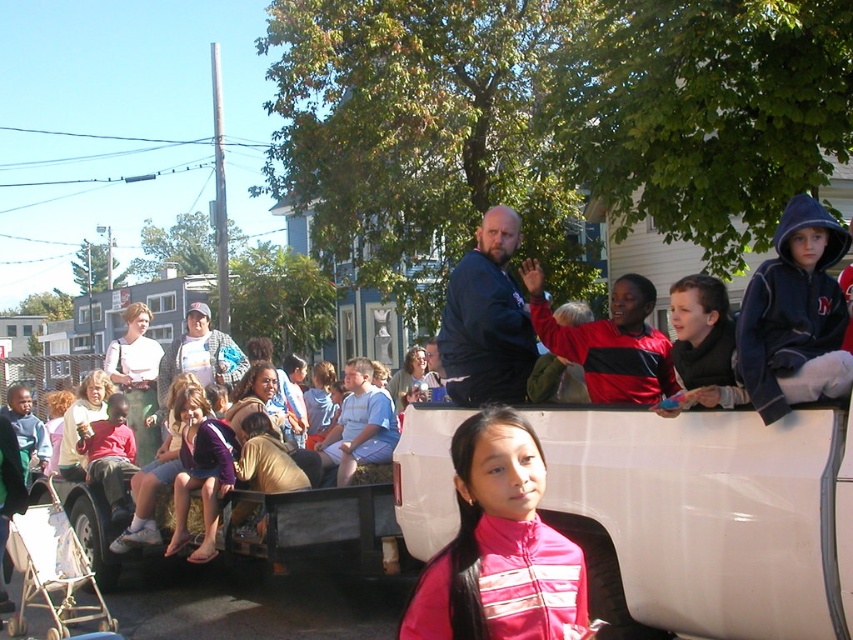
You are a photographer trying to capture the best shot of the dark blue hoodie at right and the red and black jacket at upper right. Which one can you focus on more clearly if you adjust your camera to focus on the foreground?

The dark blue hoodie at right is closer to the viewer than the red and black jacket at upper right. If the camera is focused on the foreground, the dark blue hoodie at right will be in focus while the red and black jacket at upper right may appear slightly blurred.